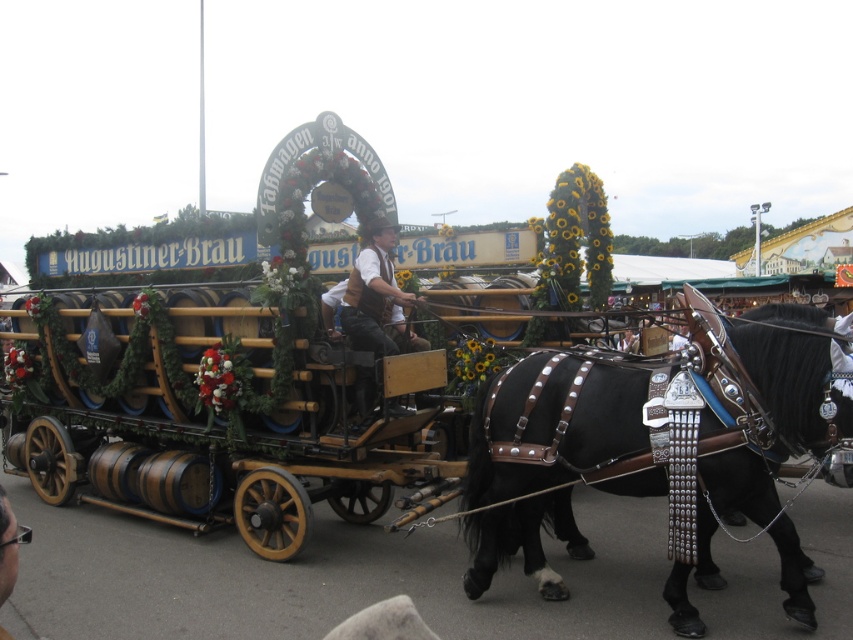
Is black leather harness at center shorter than matte brown vest at center?

No.

Can you confirm if black leather harness at center is smaller than matte brown vest at center?

No, black leather harness at center is not smaller than matte brown vest at center.

Between point (759, 449) and point (373, 316), which one is positioned behind?

The point (373, 316) is more distant.

Find the location of `black leather harness at center`. black leather harness at center is located at coordinates (650, 448).